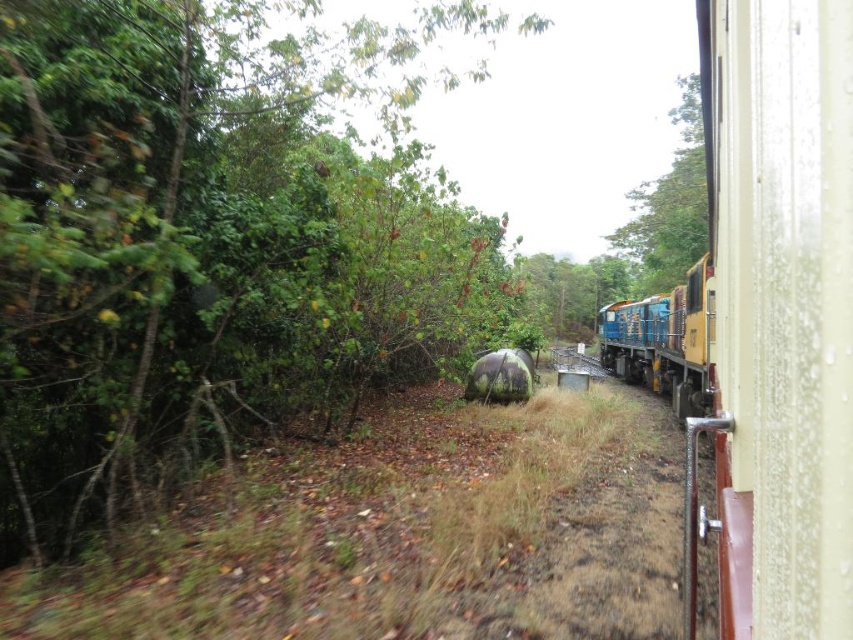
You are inside a moving train and want to locate the brown dirt track at center. According to the coordinates provided, where exactly would you look within the train window?

The brown dirt track at center is located at the coordinates point (404, 534) within the train window.

You are a passenger on the train and looking out the window. You notice the brown dirt track at center and the green leafy tree at upper center. Which object appears smaller in the scene?

The brown dirt track at center appears smaller compared to the green leafy tree at upper center.

You are sitting inside the train and looking out the window. You notice a green leafy tree at left. Based on your position, is the tree located to your left or right side of the train?

The green leafy tree at left is located to the left side of the train as you are facing forward, since the tree is described as being at the left from the viewer perspective inside the train.